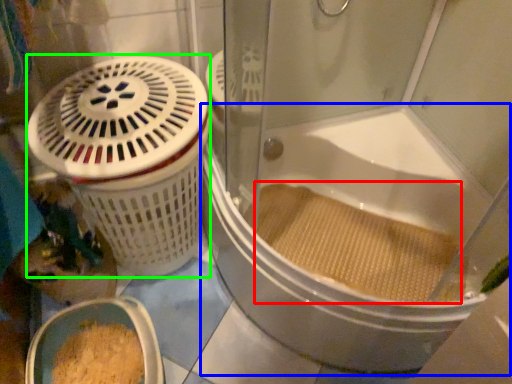
Question: Which object is positioned closest to debris (highlighted by a red box)? Select from bathtub (highlighted by a blue box) and basket container (highlighted by a green box).

Choices:
 (A) bathtub
 (B) basket container

Answer: (A)